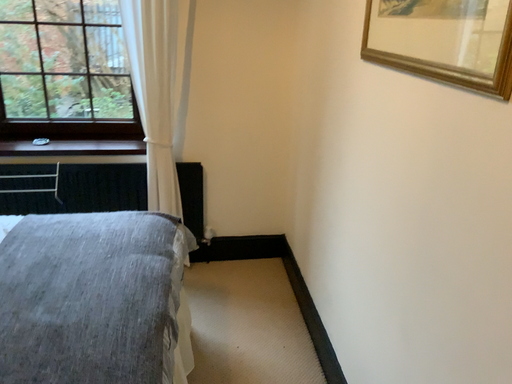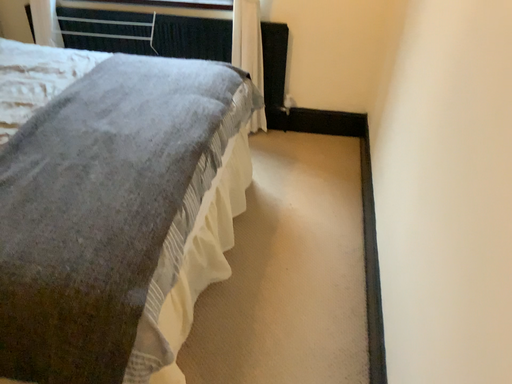
Question: Which way did the camera rotate in the video?

Choices:
 (A) rotated right
 (B) rotated left

Answer: (B)